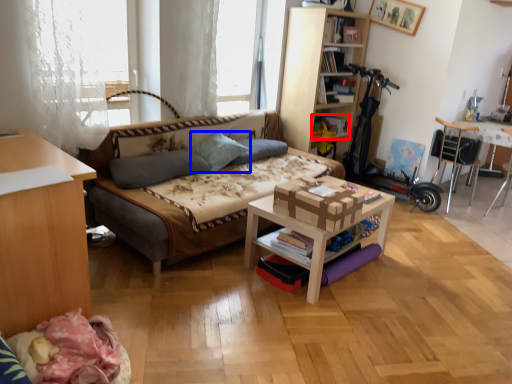
Question: Among these objects, which one is nearest to the camera, book (highlighted by a red box) or pillow (highlighted by a blue box)?

Choices:
 (A) book
 (B) pillow

Answer: (B)